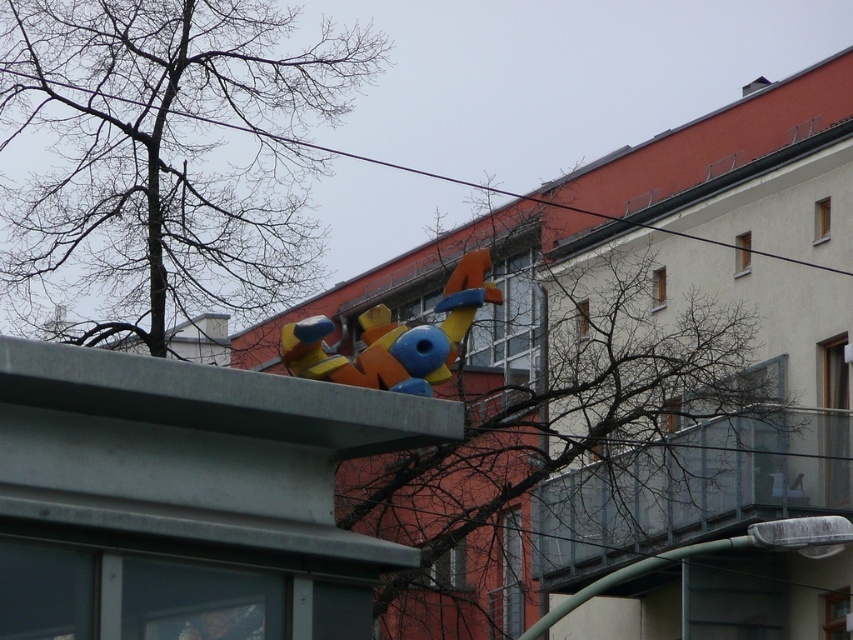
Question: Is bare branches at upper left positioned in front of matte plastic toy at center?

Choices:
 (A) yes
 (B) no

Answer: (B)

Question: Which object appears closest to the camera in this image?

Choices:
 (A) bare branches at upper center
 (B) bare branches at upper left
 (C) matte plastic toy at center
 (D) black wire at upper center

Answer: (C)

Question: Considering the relative positions of bare branches at upper center and matte plastic toy at center in the image provided, where is bare branches at upper center located with respect to matte plastic toy at center?

Choices:
 (A) above
 (B) below

Answer: (B)

Question: Can you confirm if bare branches at upper left is positioned above matte plastic toy at center?

Choices:
 (A) yes
 (B) no

Answer: (A)

Question: Which object appears closest to the camera in this image?

Choices:
 (A) matte plastic toy at center
 (B) bare branches at upper left
 (C) bare branches at upper center
 (D) black wire at upper center

Answer: (A)

Question: Estimate the real-world distances between objects in this image. Which object is farther from the black wire at upper center?

Choices:
 (A) matte plastic toy at center
 (B) bare branches at upper center
 (C) bare branches at upper left

Answer: (A)